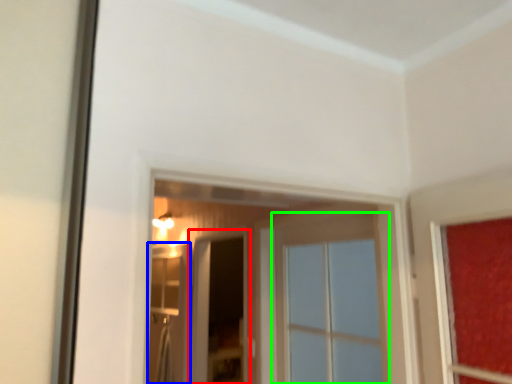
Question: Estimate the real-world distances between objects in this image. Which object is closer to screen door (highlighted by a red box), screen door (highlighted by a blue box) or window (highlighted by a green box)?

Choices:
 (A) screen door
 (B) window

Answer: (A)